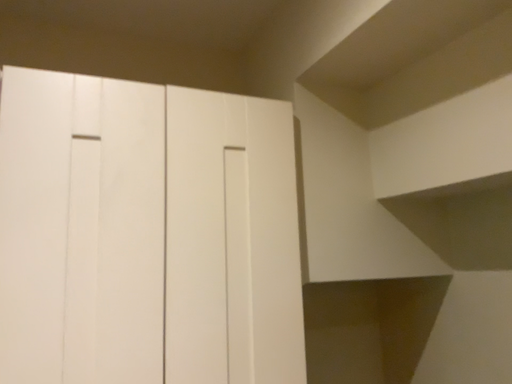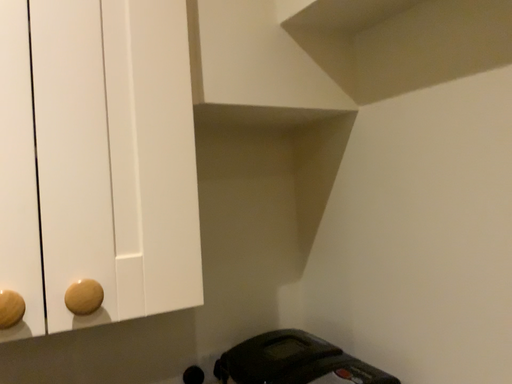
Question: Which way did the camera rotate in the video?

Choices:
 (A) rotated downward
 (B) rotated upward

Answer: (A)